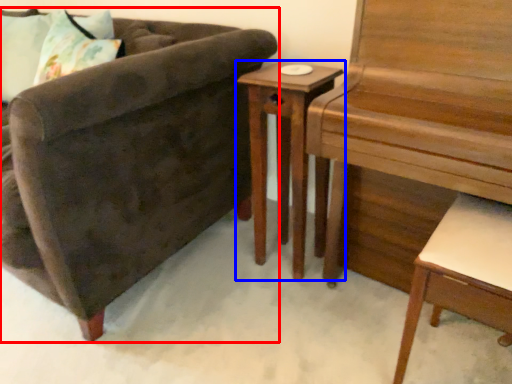
Question: Among these objects, which one is nearest to the camera, chair (highlighted by a red box) or nightstand (highlighted by a blue box)?

Choices:
 (A) chair
 (B) nightstand

Answer: (A)